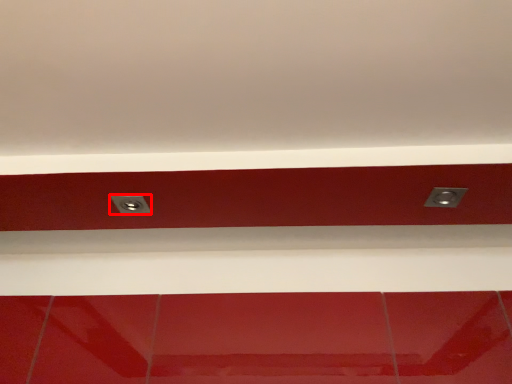
Question: From the image's perspective, what is the correct spatial positioning of power plugs and sockets (annotated by the red box) in reference to power plugs and sockets?

Choices:
 (A) above
 (B) below

Answer: (B)